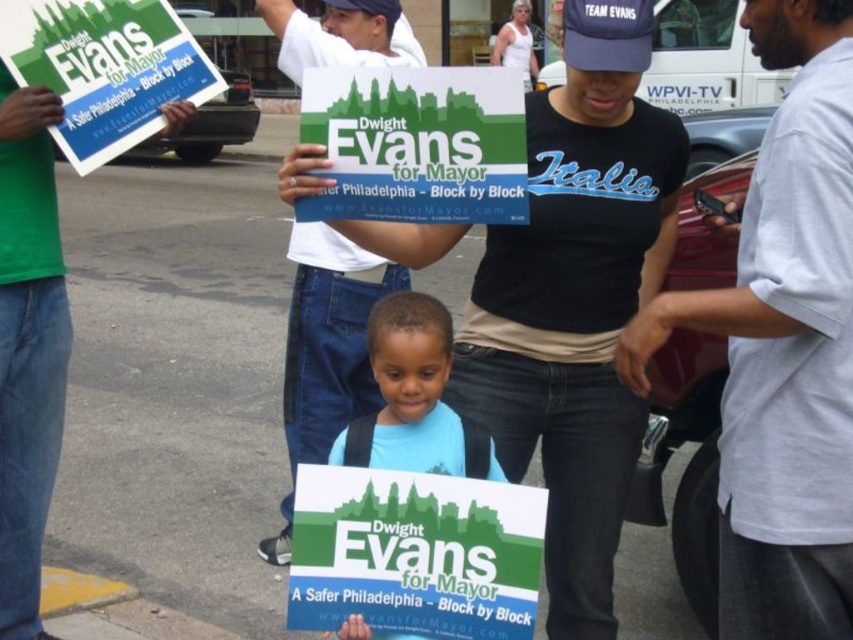
Question: Is white cotton t-shirt at center behind navy blue fabric baseball cap at upper center?

Choices:
 (A) no
 (B) yes

Answer: (B)

Question: Among these objects, which one is nearest to the camera?

Choices:
 (A) blue matte shirt at center
 (B) matte green sign at left
 (C) white cotton t-shirt at center
 (D) navy blue fabric baseball cap at upper center

Answer: (D)

Question: Can you confirm if white cotton t-shirt at center is positioned below blue matte shirt at center?

Choices:
 (A) no
 (B) yes

Answer: (B)

Question: Which of the following is the farthest from the observer?

Choices:
 (A) matte plastic sign at center
 (B) blue matte shirt at center

Answer: (B)

Question: Among these objects, which one is farthest from the camera?

Choices:
 (A) matte plastic sign at center
 (B) navy blue fabric baseball cap at upper center
 (C) light gray shirt at center
 (D) matte green sign at left

Answer: (D)

Question: Is matte plastic sign at center below blue fabric baseball cap at upper center?

Choices:
 (A) yes
 (B) no

Answer: (A)